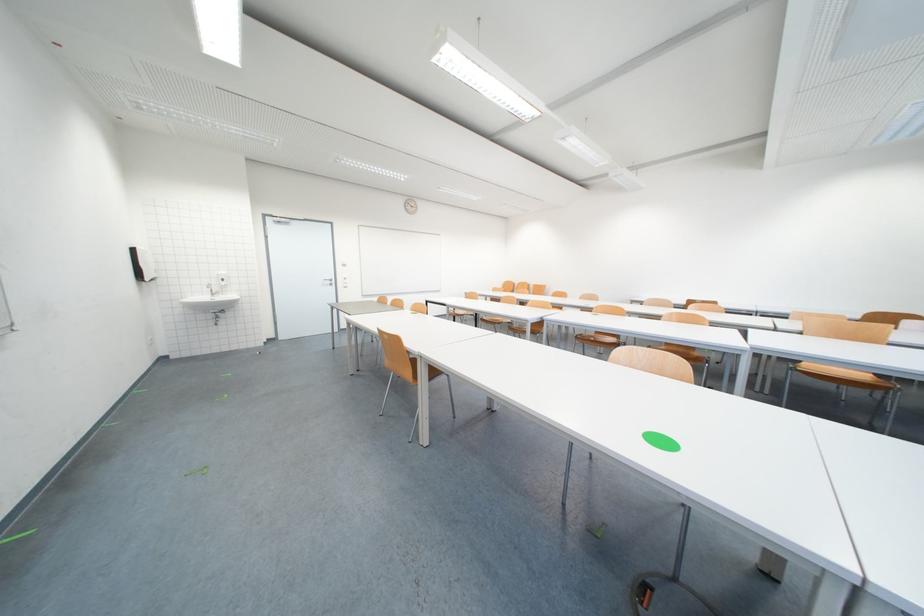
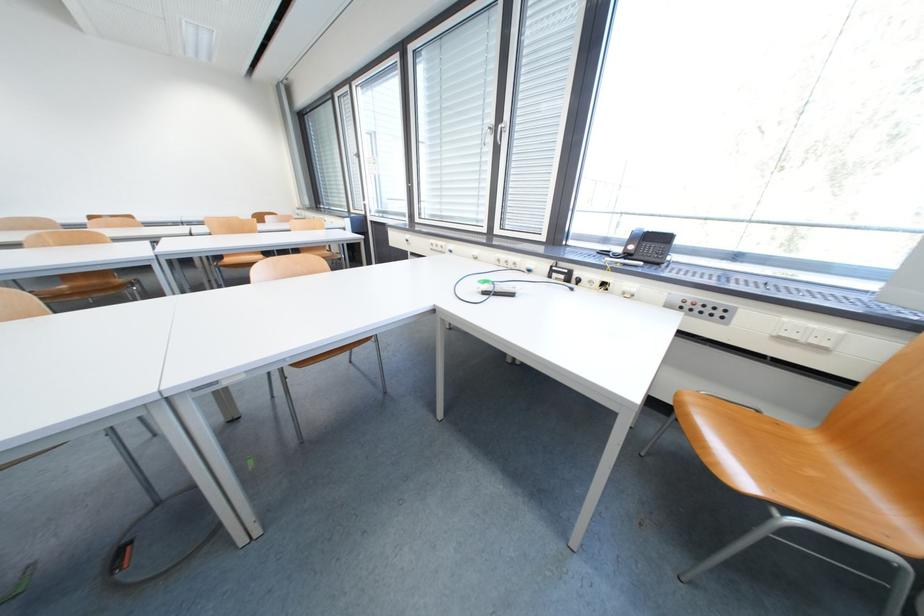
Looking at this image, the images are taken continuously from a first-person perspective. In which direction is your viewpoint rotating?

The rotation direction of the camera is right-down.